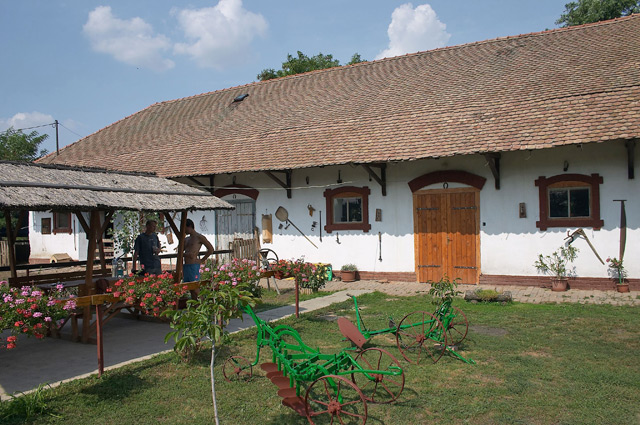
At what (x,y) coordinates should I click in order to perform the action: click on arch over door. Please return your answer as a coordinate pair (x, y). This screenshot has width=640, height=425. Looking at the image, I should click on (443, 174).